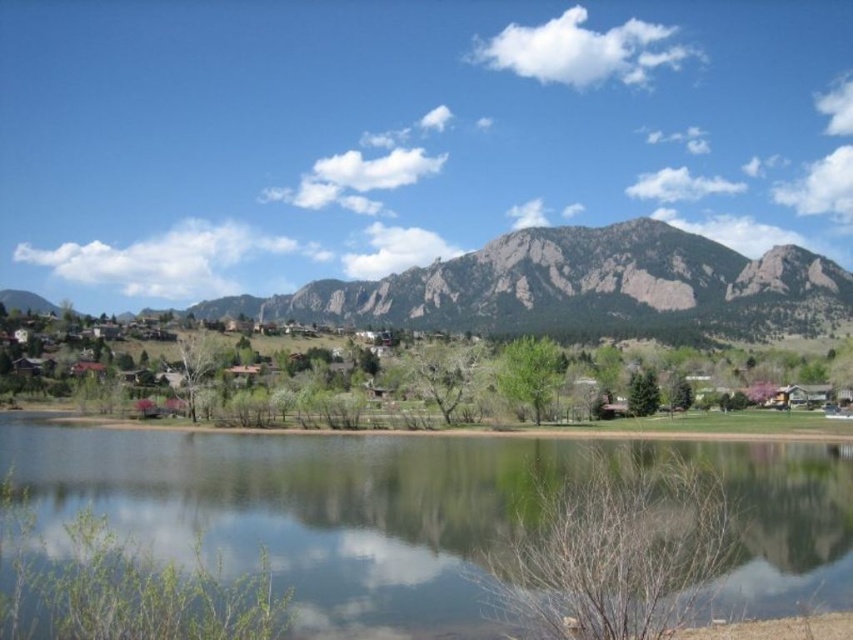
You are standing at the edge of the clear water at center and want to walk to the green grassy mountain at center. Based on the scene, which direction should you face to head directly towards the mountain?

The clear water at center has a lesser width compared to green grassy mountain at center, so you should face towards the direction of the green grassy mountain at center to head directly towards it.

Consider the image. You are standing at the point marked as point (334, 568) and want to walk to the point marked as point (575, 304). Based on the scene description, which direction should you move relative to your current position?

You should move towards the upper right direction because point (575, 304) is further away from the camera compared to your current position at point (334, 568).

You are standing at the edge of the clear water at center and looking towards the green grassy mountain at center. Which object appears taller from your perspective?

The green grassy mountain at center appears taller than the clear water at center because the clear water at center is not as tall as the green grassy mountain at center.